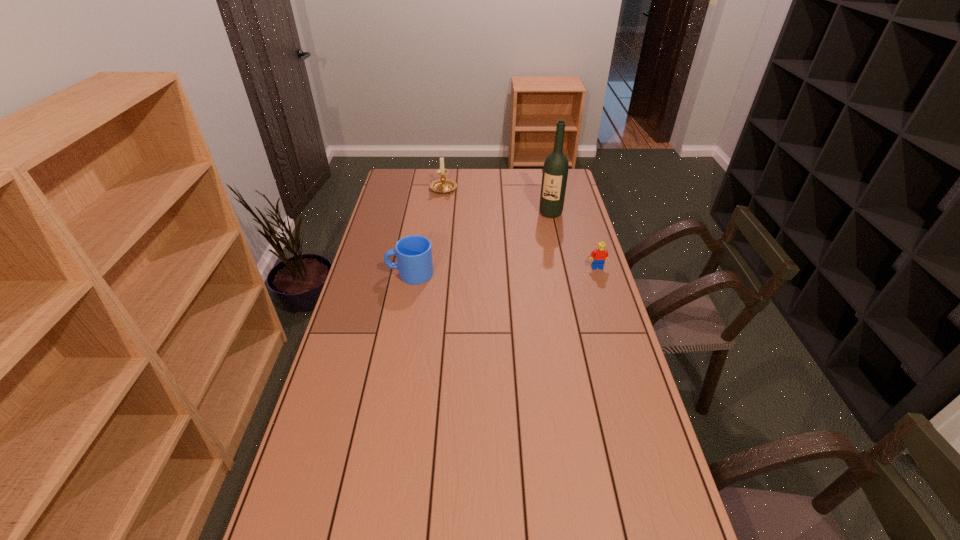
Find the location of `mug`. mug is located at coordinates (414, 257).

This screenshot has width=960, height=540. I want to click on the rightmost object, so click(599, 255).

This screenshot has height=540, width=960. I want to click on the second tallest object, so click(442, 185).

You are a GUI agent. You are given a task and a screenshot of the screen. Output one action in this format:
    pyautogui.click(x=<x>, y=<y>)
    Task: Click on the candle holder
    This screenshot has width=960, height=540.
    Given the screenshot: What is the action you would take?
    pyautogui.click(x=442, y=185)

Locate an element on the screen. The height and width of the screenshot is (540, 960). wine bottle is located at coordinates (555, 170).

What are the coordinates of `the third object from left to right` in the screenshot? It's located at (555, 170).

Identify the location of free location located on the side of the mug with the handle. The height and width of the screenshot is (540, 960). (373, 273).

The width and height of the screenshot is (960, 540). I want to click on free space located on the side of the mug with the handle, so click(373, 273).

At what (x,y) coordinates should I click in order to perform the action: click on vacant space located on the side of the mug with the handle. Please return your answer as a coordinate pair (x, y). Image resolution: width=960 pixels, height=540 pixels. Looking at the image, I should click on (368, 273).

Where is `blank space located 0.400m on the face of the rightmost object`? This screenshot has height=540, width=960. blank space located 0.400m on the face of the rightmost object is located at coordinates (623, 351).